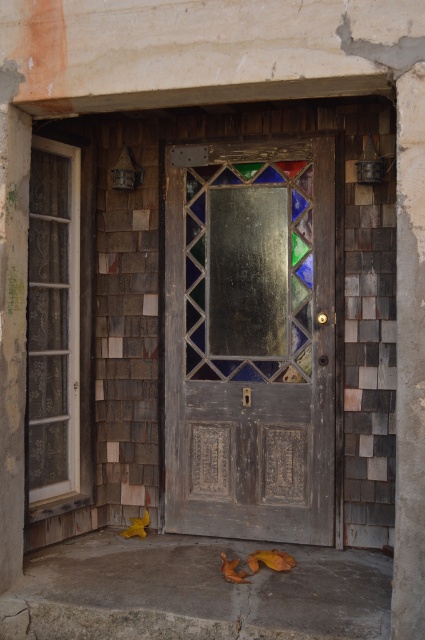
Question: Based on their relative distances, which object is farther from the stained glass panel at center?

Choices:
 (A) clear glass window at left
 (B) stained glass door at center

Answer: (A)

Question: Considering the relative positions of stained glass door at center and clear glass window at left in the image provided, where is stained glass door at center located with respect to clear glass window at left?

Choices:
 (A) below
 (B) above

Answer: (A)

Question: Which point is farther to the camera?

Choices:
 (A) stained glass panel at center
 (B) stained glass door at center

Answer: (A)

Question: Is stained glass panel at center bigger than clear glass window at left?

Choices:
 (A) yes
 (B) no

Answer: (B)

Question: Can you confirm if stained glass door at center is thinner than clear glass window at left?

Choices:
 (A) no
 (B) yes

Answer: (A)

Question: Which object appears farthest from the camera in this image?

Choices:
 (A) stained glass door at center
 (B) stained glass panel at center
 (C) clear glass window at left

Answer: (B)